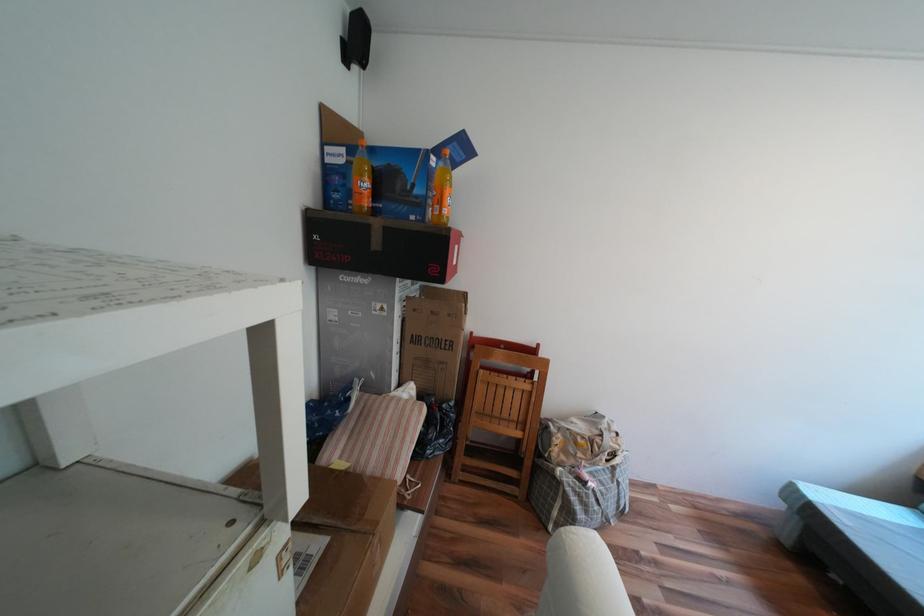
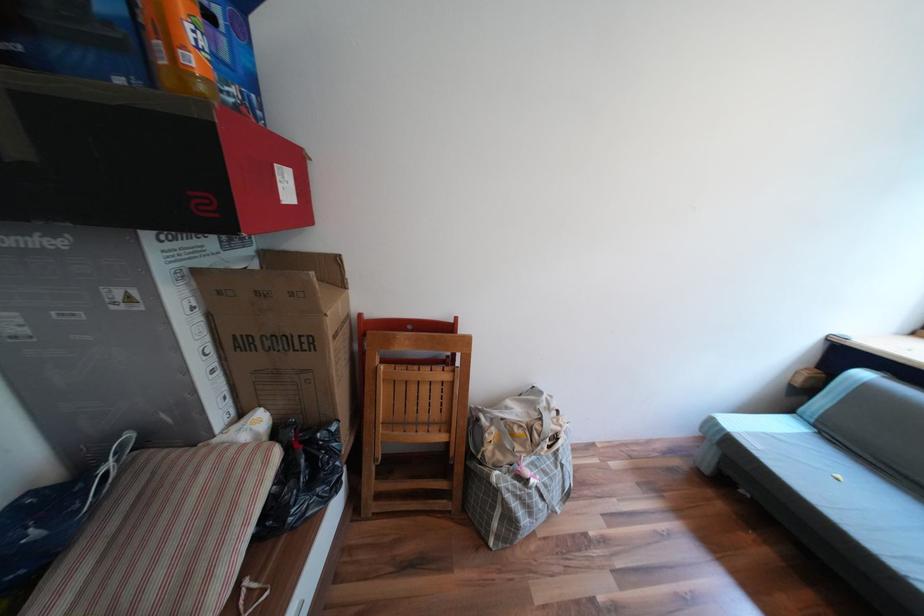
Find the pixel in the second image that matches the point at 454,406 in the first image.

(327, 435)